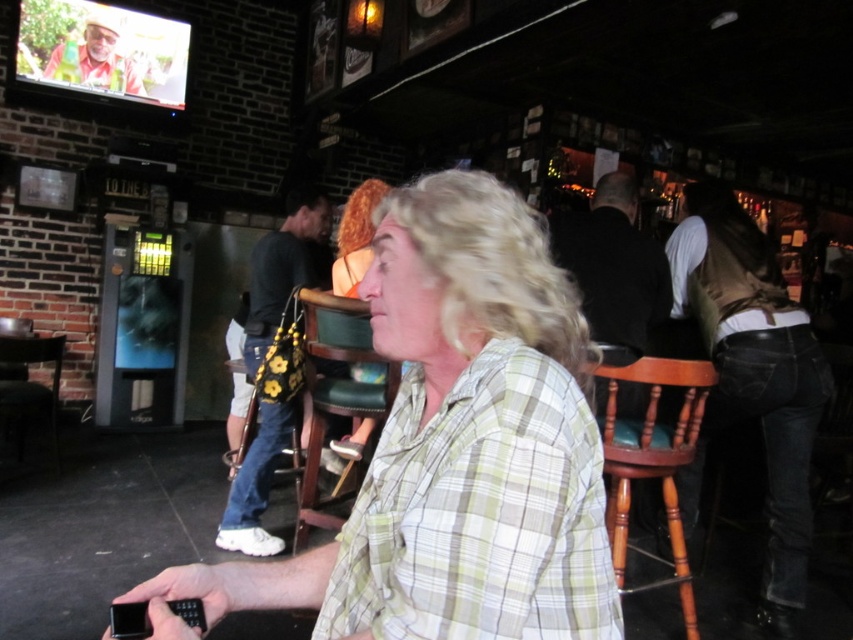
Does point (447, 577) lie behind point (689, 310)?

No, it is in front of (689, 310).

Is green plaid shirt at center bigger than denim jeans at right?

Incorrect, green plaid shirt at center is not larger than denim jeans at right.

Does point (316, 609) come closer to viewer compared to point (792, 616)?

That is True.

Locate an element on the screen. green plaid shirt at center is located at coordinates (454, 449).

How far apart are green plaid shirt at center and floral-patterned fabric bag at center?

The distance of green plaid shirt at center from floral-patterned fabric bag at center is 6.54 feet.

Does green plaid shirt at center appear on the left side of floral-patterned fabric bag at center?

Incorrect, green plaid shirt at center is not on the left side of floral-patterned fabric bag at center.

Find the location of a particular element. Image resolution: width=853 pixels, height=640 pixels. green plaid shirt at center is located at coordinates (454, 449).

Looking at this image, can you confirm if green plaid shirt at center is positioned above black leather jacket at upper center?

No, green plaid shirt at center is not above black leather jacket at upper center.

Between green plaid shirt at center and black leather jacket at upper center, which one has less height?

green plaid shirt at center

The image size is (853, 640). I want to click on green plaid shirt at center, so click(454, 449).